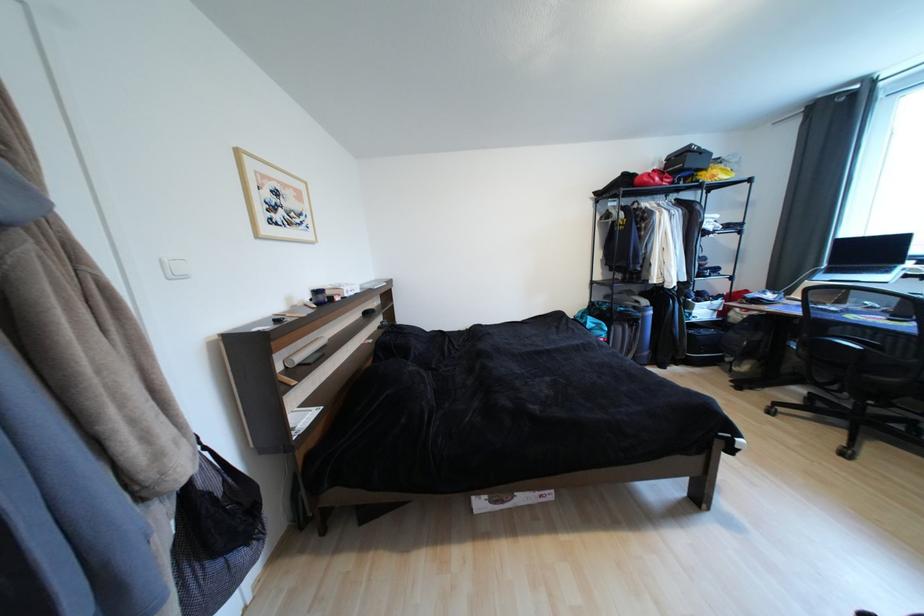
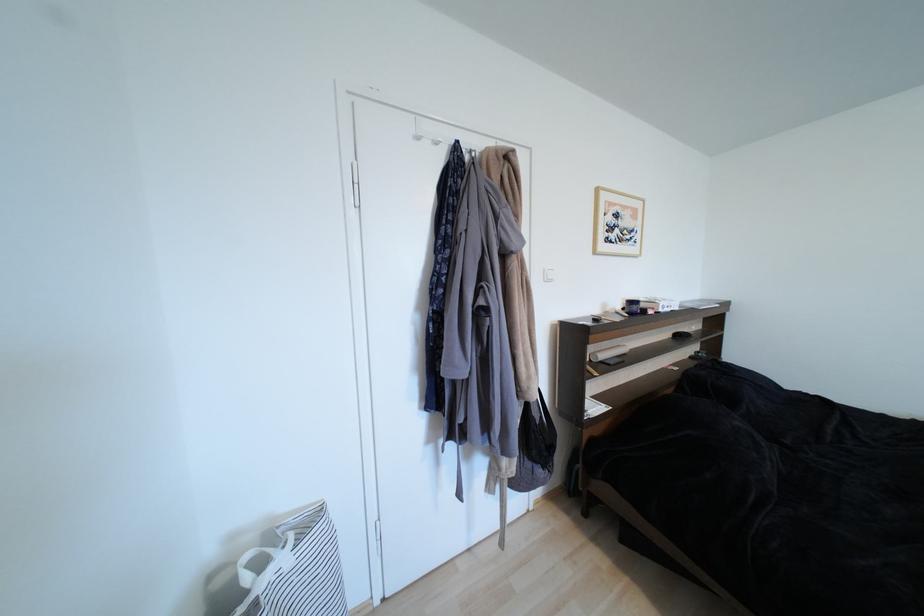
Question: The first image is from the beginning of the video and the second image is from the end. How did the camera likely rotate when shooting the video?

Choices:
 (A) Left
 (B) Right
 (C) Up
 (D) Down

Answer: (A)